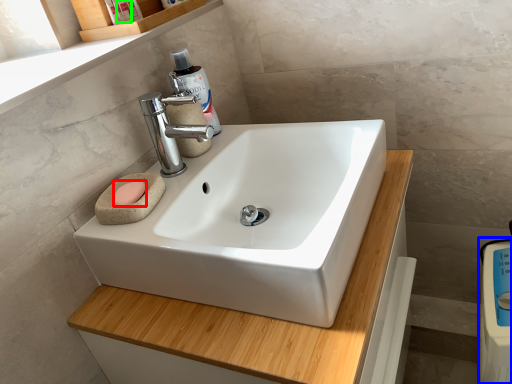
Question: Estimate the real-world distances between objects in this image. Which object is closer to soap (highlighted by a red box), appliance (highlighted by a blue box) or toiletry (highlighted by a green box)?

Choices:
 (A) appliance
 (B) toiletry

Answer: (B)